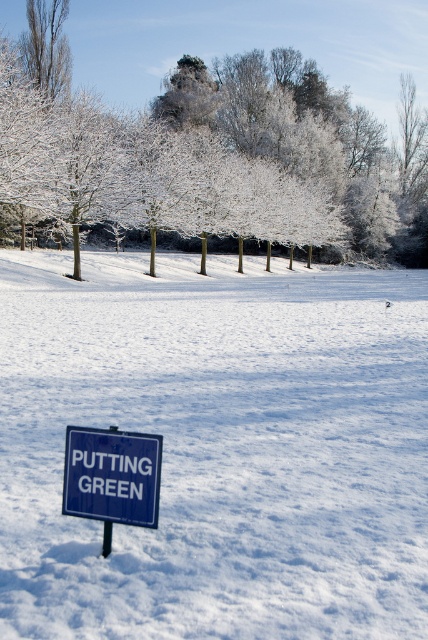
Is white powdery snow at center to the left of metallic pole at lower center from the viewer's perspective?

Incorrect, white powdery snow at center is not on the left side of metallic pole at lower center.

Between point (214, 499) and point (109, 529), which one is positioned behind?

The point (214, 499) is more distant.

Find the location of a particular element. This screenshot has width=428, height=640. white powdery snow at center is located at coordinates (217, 448).

Between white powdery snow at center and white frosty tree at center, which one has less height?

With less height is white powdery snow at center.

Is point (223, 339) positioned behind point (386, 104)?

No.

Which is behind, point (211, 440) or point (300, 51)?

The point (300, 51) is behind.

Identify the location of white powdery snow at center. This screenshot has width=428, height=640. (217, 448).

Does blue plastic sign at lower left appear on the left side of metallic pole at lower center?

No, blue plastic sign at lower left is not to the left of metallic pole at lower center.

In the scene shown: Does blue plastic sign at lower left have a lesser height compared to metallic pole at lower center?

In fact, blue plastic sign at lower left may be taller than metallic pole at lower center.

This screenshot has height=640, width=428. I want to click on blue plastic sign at lower left, so click(112, 476).